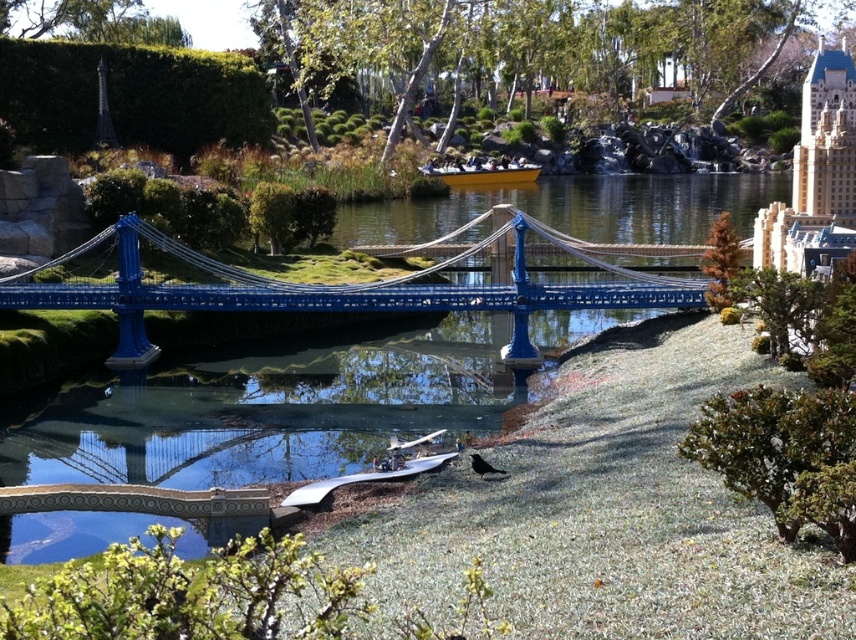
Who is taller, metallic blue bridge at center or yellow matte boat at center?

metallic blue bridge at center

Image resolution: width=856 pixels, height=640 pixels. Describe the element at coordinates (337, 289) in the screenshot. I see `metallic blue bridge at center` at that location.

Is point (554, 291) positioned after point (504, 182)?

No, it is not.

Where is `metallic blue bridge at center`? Image resolution: width=856 pixels, height=640 pixels. metallic blue bridge at center is located at coordinates (337, 289).